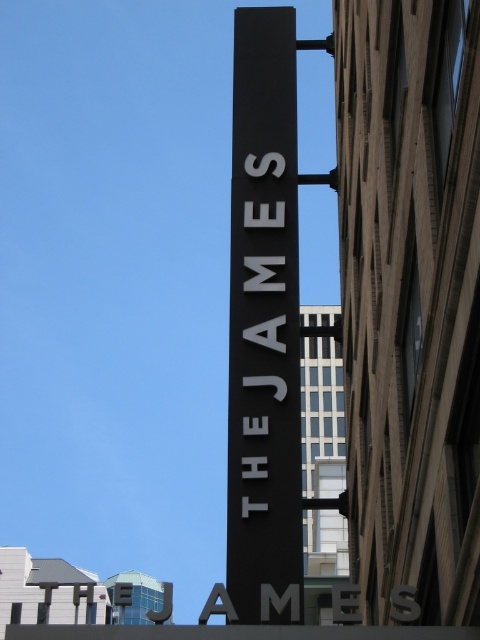
You are standing at the base of the pole holding both the black matte sign at center and the white matte sign at center. If you look up, which sign will you see first?

The black matte sign at center is above the white matte sign at center, so you will see the black matte sign at center first when looking up.

You are standing in front of an urban landscape and see the point marked at coordinates (264, 324). What object is located at this point?

The point at (264, 324) corresponds to the black matte sign at center.

You are standing at the base of the black matte sign at center, which is mounted on a pole. You want to take a photo of the sign with your smartphone camera. Considering the sign is 74.98 feet away from you, will you be able to capture the entire sign in one shot without moving your phone?

The black matte sign at center is 74.98 feet away from the camera. Since smartphones typically have a wide enough angle to capture objects at that distance when positioned directly in front, you should be able to capture the entire sign in one shot without moving your phone.